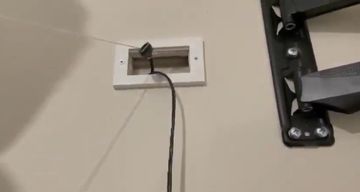
Where is `cable`? This screenshot has width=360, height=192. cable is located at coordinates (172, 138).